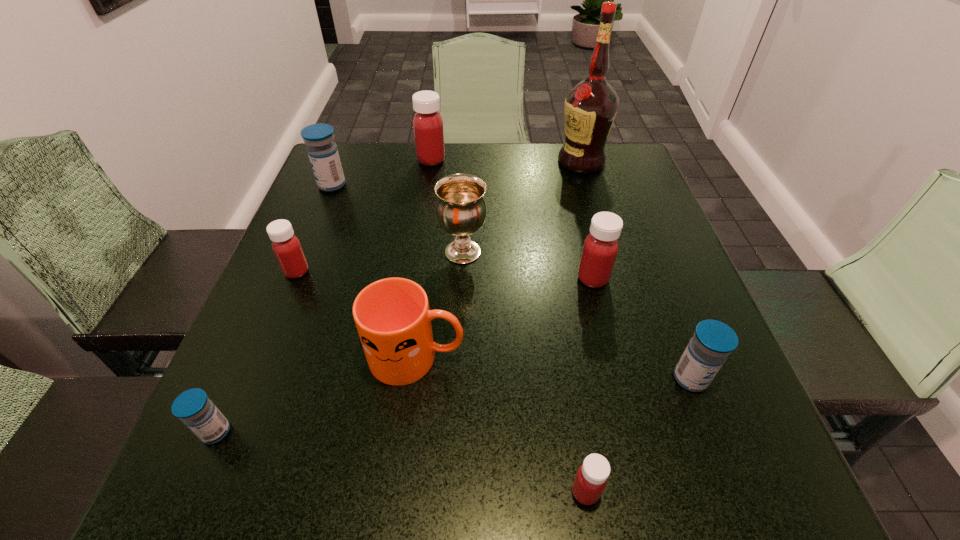
You are a GUI agent. You are given a task and a screenshot of the screen. Output one action in this format:
    pyautogui.click(x=<x>, y=<y>)
    Task: Click on the alcohol that is positioned at the right edge
    This screenshot has height=540, width=960.
    Given the screenshot: What is the action you would take?
    pyautogui.click(x=590, y=106)

Find the location of a particular element. The height and width of the screenshot is (540, 960). medicine present at the right edge is located at coordinates (712, 342).

In order to click on object at the far left corner in this screenshot , I will do `click(323, 154)`.

You are a GUI agent. You are given a task and a screenshot of the screen. Output one action in this format:
    pyautogui.click(x=<x>, y=<y>)
    Task: Click on the object that is at the near left corner
    The image size is (960, 540).
    Given the screenshot: What is the action you would take?
    pyautogui.click(x=195, y=409)

This screenshot has height=540, width=960. What are the coordinates of `object present at the far right corner` in the screenshot? It's located at (590, 106).

In the image, there is a desktop. Where is `vacant space at the far edge`? This screenshot has width=960, height=540. vacant space at the far edge is located at coordinates (449, 149).

Locate an element on the screen. vacant space at the near edge is located at coordinates (643, 448).

Find the location of `vacant region at the left edge of the desktop`. vacant region at the left edge of the desktop is located at coordinates (334, 298).

In the image, there is a desktop. Identify the location of vacant space at the right edge. Image resolution: width=960 pixels, height=540 pixels. (632, 211).

This screenshot has width=960, height=540. In order to click on vacant space at the far left corner of the desktop in this screenshot , I will do `click(373, 154)`.